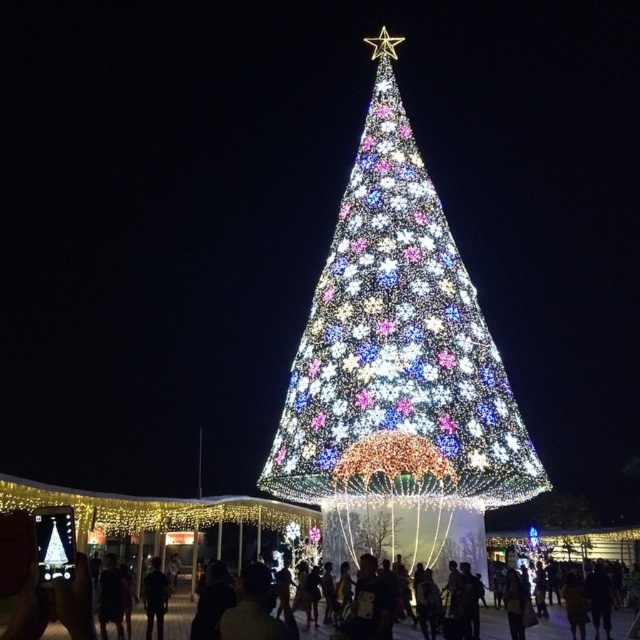
Question: Can you confirm if illuminated plastic christmas tree at center is bigger than dark hair at lower center?

Choices:
 (A) yes
 (B) no

Answer: (A)

Question: Is illuminated plastic christmas tree at center closer to the viewer compared to dark hair at lower center?

Choices:
 (A) no
 (B) yes

Answer: (A)

Question: Which object is closer to the camera taking this photo?

Choices:
 (A) illuminated plastic christmas tree at center
 (B) dark hair at lower center

Answer: (B)

Question: Can you confirm if illuminated plastic christmas tree at center is bigger than dark hair at lower center?

Choices:
 (A) no
 (B) yes

Answer: (B)